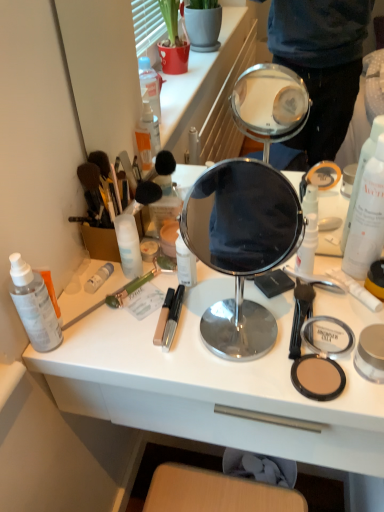
In order to click on vacant space to the right of transparent plastic spray bottle at left, which is the 6th toiletry in right-to-left order in this screenshot , I will do `click(147, 334)`.